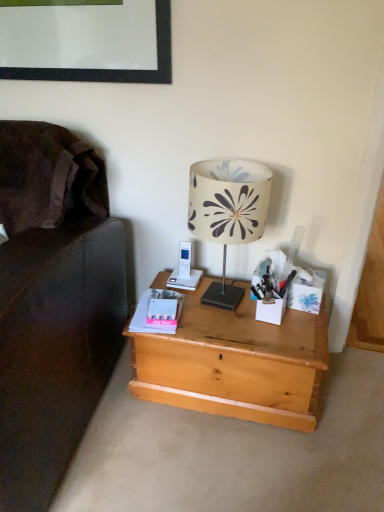
The height and width of the screenshot is (512, 384). Find the location of `vacant space in front of white matte box at right`. vacant space in front of white matte box at right is located at coordinates (302, 331).